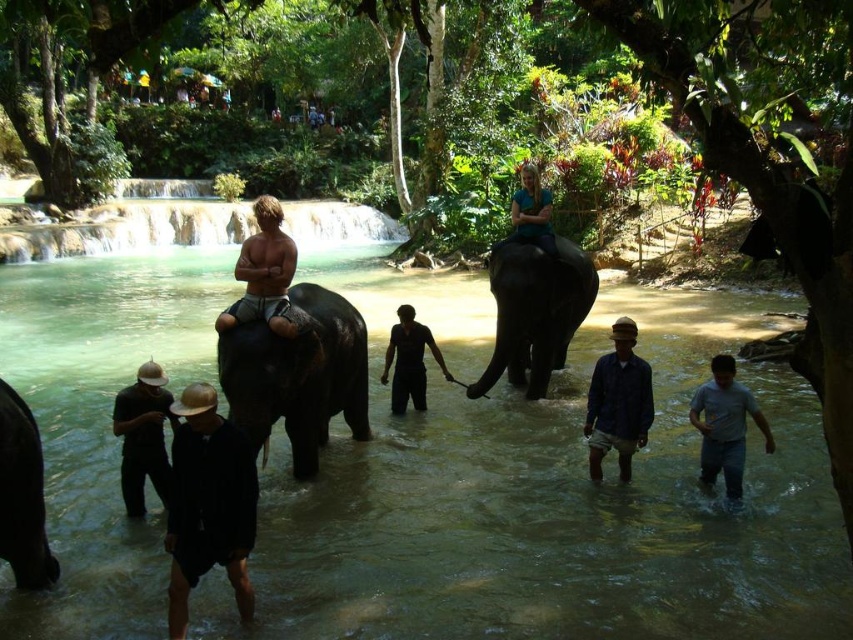
Can you confirm if greenish-brown water at center is positioned to the right of black matte pants at center?

Incorrect, greenish-brown water at center is not on the right side of black matte pants at center.

Which is behind, point (433, 480) or point (403, 387)?

The point (403, 387) is behind.

Is point (94, 273) positioned before point (393, 349)?

No, it is not.

Where is `greenish-brown water at center`? The image size is (853, 640). greenish-brown water at center is located at coordinates (543, 493).

Does point (194, 465) come in front of point (424, 371)?

Yes, it is.

Does point (210, 536) come farther from viewer compared to point (440, 356)?

No, it is in front of (440, 356).

Where is `black matte hat at center`? black matte hat at center is located at coordinates (207, 504).

This screenshot has height=640, width=853. In order to click on black matte hat at center in this screenshot , I will do `click(207, 504)`.

Locate an element on the screen. The height and width of the screenshot is (640, 853). clear blue water at center is located at coordinates (131, 228).

Is point (1, 257) closer to viewer compared to point (572, 320)?

No, it is behind (572, 320).

What are the coordinates of `clear blue water at center` in the screenshot? It's located at (131, 228).